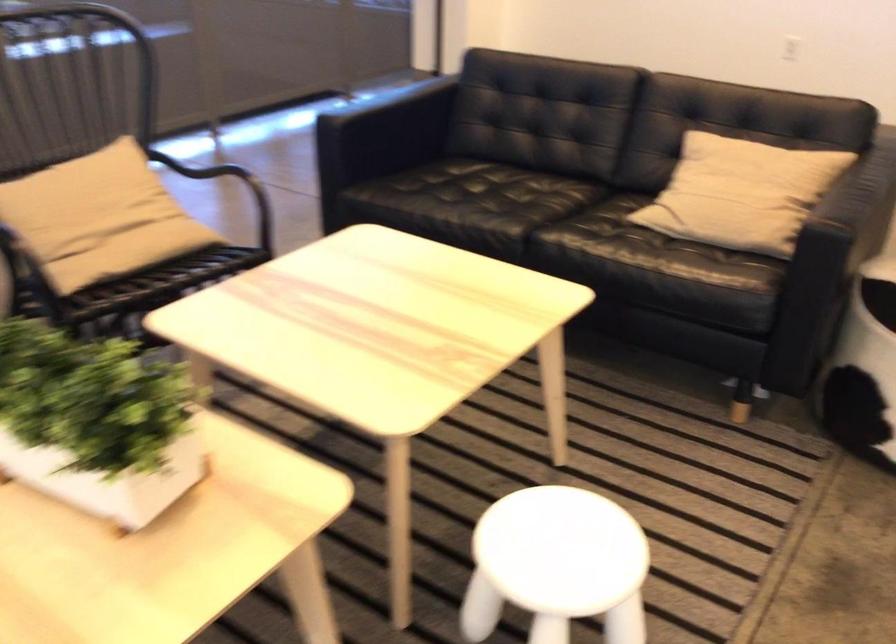
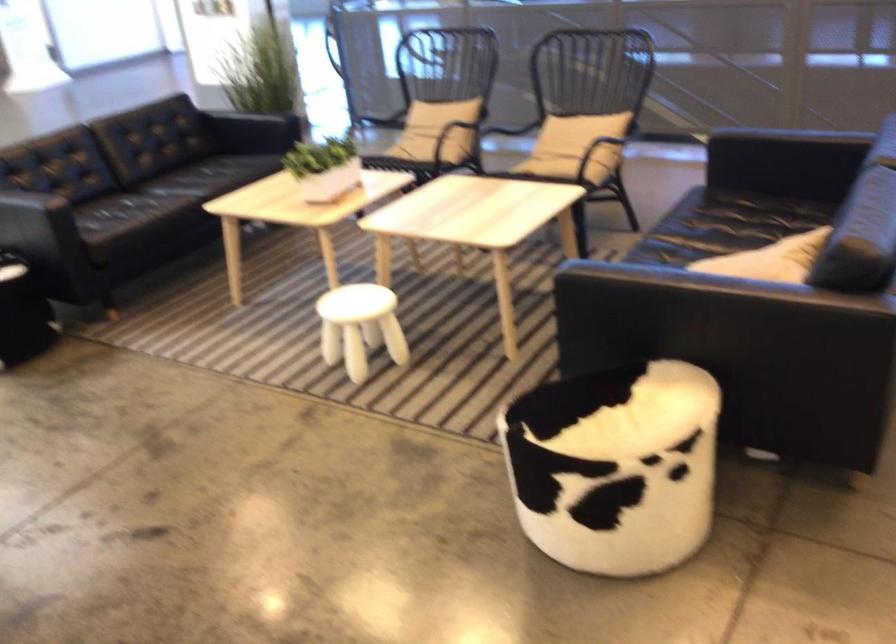
Locate, in the second image, the point that corresponds to point 156,252 in the first image.

(552, 160)